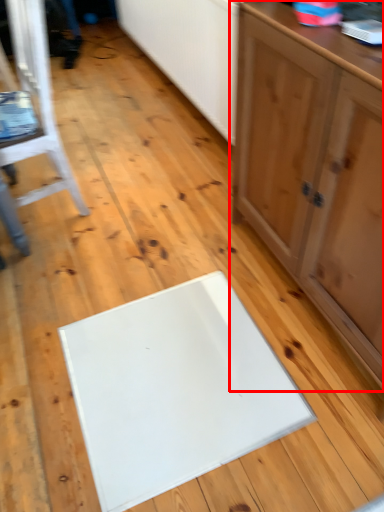
Question: Observing the image, what is the correct spatial positioning of cabinetry (annotated by the red box) in reference to furniture?

Choices:
 (A) left
 (B) right

Answer: (B)